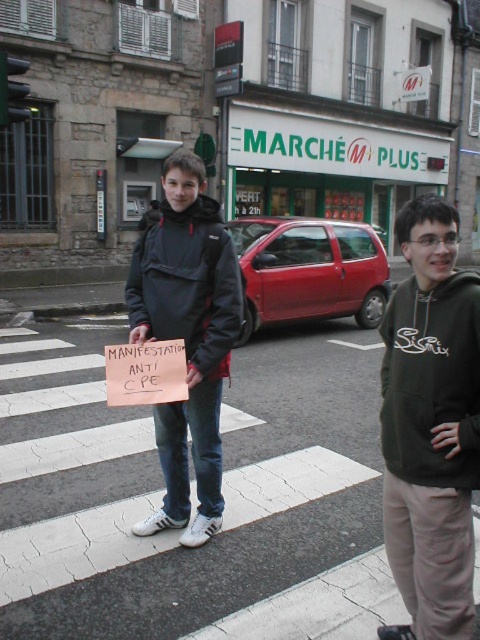
Question: Is dark green hoodie at center wider than matte black jacket at center?

Choices:
 (A) no
 (B) yes

Answer: (A)

Question: Which object is farther from the camera taking this photo?

Choices:
 (A) matte black jacket at center
 (B) dark green hoodie at center

Answer: (A)

Question: Can you confirm if dark green hoodie at center is positioned below matte black jacket at center?

Choices:
 (A) no
 (B) yes

Answer: (B)

Question: Which point is closer to the camera?

Choices:
 (A) (166, 269)
 (B) (399, 541)

Answer: (B)

Question: Where is dark green hoodie at center located in relation to matte black jacket at center in the image?

Choices:
 (A) above
 (B) below

Answer: (B)